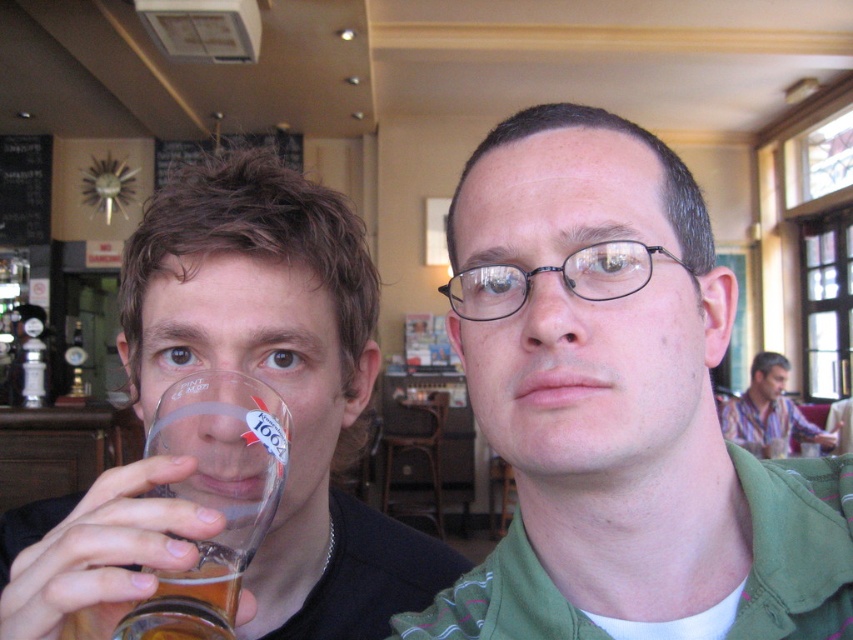
Which is above, clear glass beer glass at left or translucent glass beer at lower left?

clear glass beer glass at left is above.

Who is shorter, clear glass beer glass at left or translucent glass beer at lower left?

translucent glass beer at lower left is shorter.

Is point (276, 451) positioned behind point (161, 632)?

Yes, point (276, 451) is farther from viewer.

Find the location of a particular element. The height and width of the screenshot is (640, 853). clear glass beer glass at left is located at coordinates (213, 497).

From the picture: Can you confirm if clear glass beer glass at left is smaller than striped cotton shirt at right?

Yes.

Which of these two, clear glass beer glass at left or striped cotton shirt at right, stands taller?

Standing taller between the two is striped cotton shirt at right.

What do you see at coordinates (213, 497) in the screenshot? Image resolution: width=853 pixels, height=640 pixels. I see `clear glass beer glass at left` at bounding box center [213, 497].

Find the location of `clear glass beer glass at left`. clear glass beer glass at left is located at coordinates (213, 497).

Which is above, clear glass beer at left or striped cotton shirt at right?

clear glass beer at left is above.

Does clear glass beer at left have a lesser height compared to striped cotton shirt at right?

Yes, clear glass beer at left is shorter than striped cotton shirt at right.

This screenshot has width=853, height=640. Find the location of `clear glass beer at left`. clear glass beer at left is located at coordinates (280, 378).